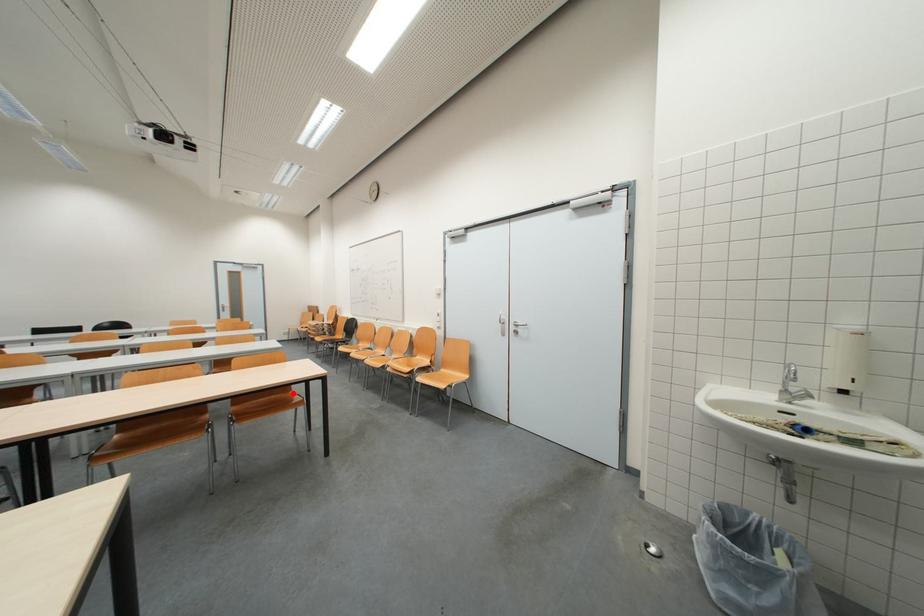
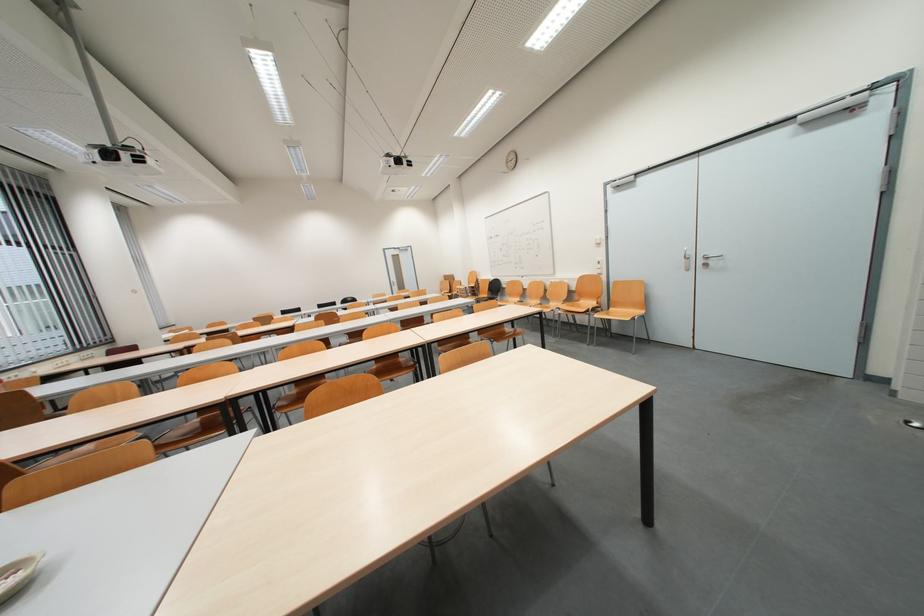
In the second image, find the point that corresponds to the highlighted location in the first image.

(507, 330)